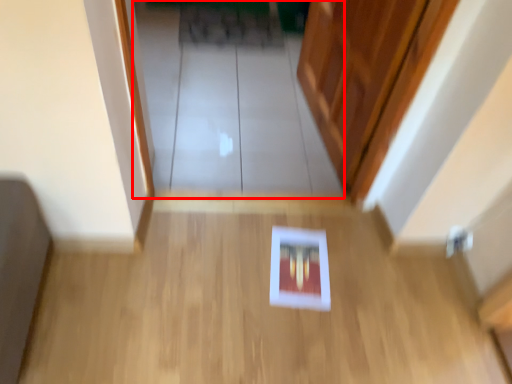
Question: From the image's perspective, what is the correct spatial relationship of glass door (annotated by the red box) in relation to corridor?

Choices:
 (A) below
 (B) above

Answer: (B)